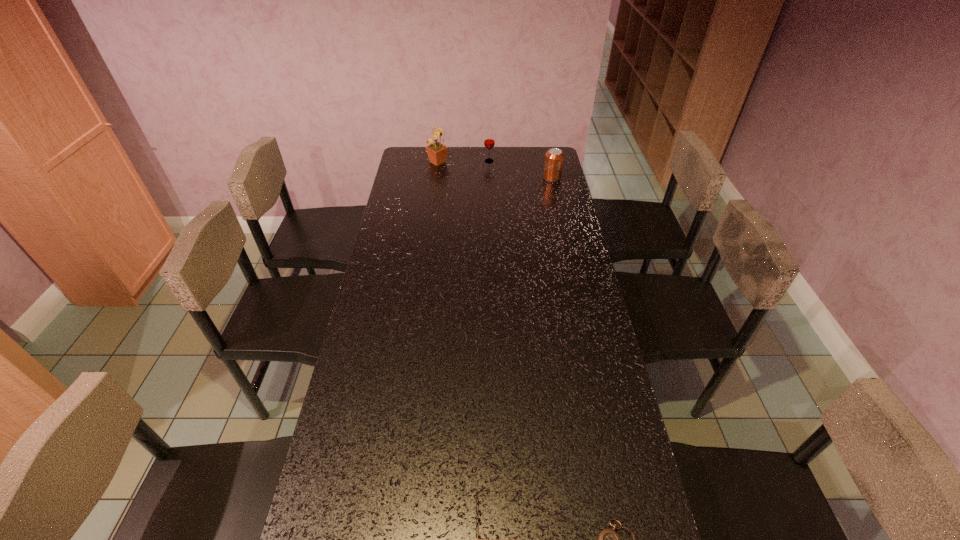
Locate an element on the screen. This screenshot has height=540, width=960. object at the right edge is located at coordinates (554, 157).

In order to click on object situated at the far left corner in this screenshot , I will do `click(437, 152)`.

In the image, there is a desktop. Find the location of `free space at the far edge`. free space at the far edge is located at coordinates (513, 161).

Locate an element on the screen. vacant space at the left edge of the desktop is located at coordinates (317, 489).

I want to click on vacant space at the right edge of the desktop, so click(554, 230).

Image resolution: width=960 pixels, height=540 pixels. Identify the location of free location at the far left corner of the desktop. (432, 164).

Locate an element on the screen. free location at the far right corner is located at coordinates (531, 163).

In order to click on vacant space in between the glass and the third farthest object in this screenshot , I will do `click(520, 170)`.

This screenshot has height=540, width=960. In order to click on free space between the third nearest object and the glass in this screenshot , I will do `click(520, 170)`.

The image size is (960, 540). Find the location of `vacant area between the can and the glass`. vacant area between the can and the glass is located at coordinates pyautogui.click(x=520, y=170).